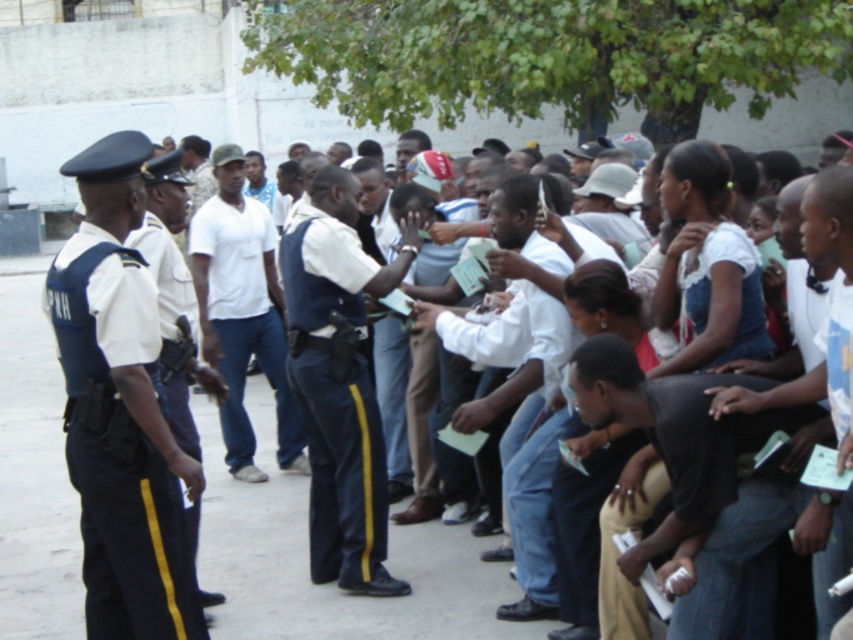
You are a photographer standing at the point with coordinates (509, 310). What object is directly in front of you?

The white matte shirt at center is directly in front of you at point (509, 310).

In the scene shown: You are organizing a community event and need to identify the volunteers wearing the correct attire. The volunteers should be wearing the white cotton shirt at center that is underneath the white matte shirt at center. Which volunteer is wearing both shirts correctly?

The volunteer wearing the white cotton shirt at center positioned under the white matte shirt at center is the one with the correct attire.